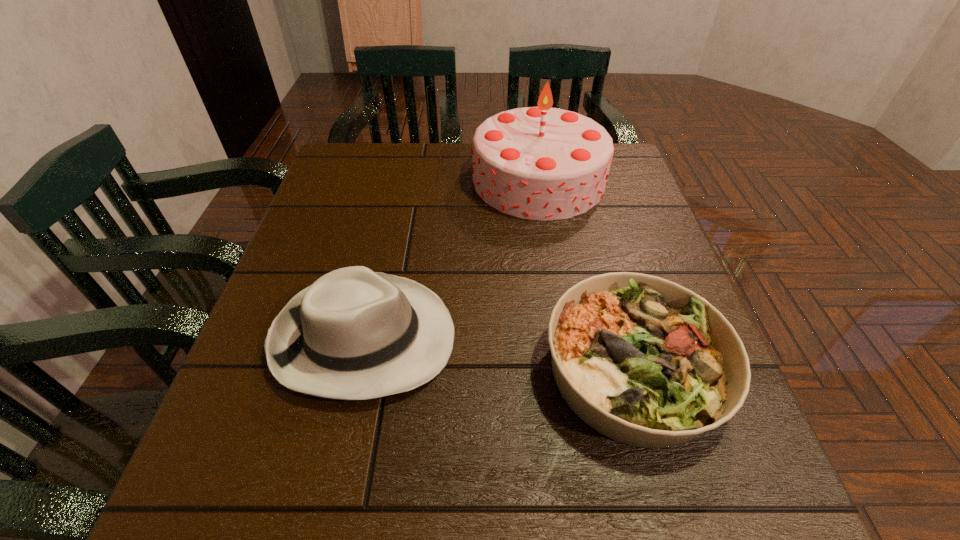
Locate an element on the screen. This screenshot has width=960, height=540. the tallest object is located at coordinates (540, 163).

Where is `birthday cake`? The height and width of the screenshot is (540, 960). birthday cake is located at coordinates (540, 163).

Image resolution: width=960 pixels, height=540 pixels. I want to click on the second shortest object, so click(354, 334).

Identify the location of fedora. The image size is (960, 540). (354, 334).

Identify the location of salad plate. (644, 361).

Where is `free space located 0.320m on the front of the birthday cake`? free space located 0.320m on the front of the birthday cake is located at coordinates (564, 334).

At what (x,y) coordinates should I click in order to perform the action: click on vacant space located 0.070m on the front-facing side of the second shortest object. Please return your answer as a coordinate pair (x, y). This screenshot has height=540, width=960. Looking at the image, I should click on (493, 338).

The width and height of the screenshot is (960, 540). Find the location of `vacant space located 0.050m on the back of the shortest object`. vacant space located 0.050m on the back of the shortest object is located at coordinates (609, 282).

You are a GUI agent. You are given a task and a screenshot of the screen. Output one action in this format:
    pyautogui.click(x=<x>, y=<y>)
    Task: Click on the object that is at the far edge
    
    Given the screenshot: What is the action you would take?
    pyautogui.click(x=540, y=163)

I want to click on object that is at the near edge, so click(x=644, y=361).